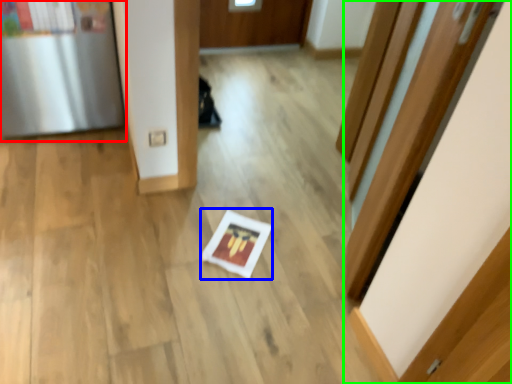
Question: Estimate the real-world distances between objects in this image. Which object is closer to fridge (highlighted by a red box), copy (highlighted by a blue box) or door (highlighted by a green box)?

Choices:
 (A) copy
 (B) door

Answer: (A)